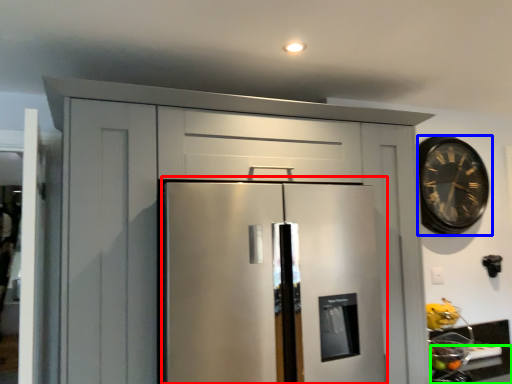
Question: Estimate the real-world distances between objects in this image. Which object is closer to appliance (highlighted by a red box), clock (highlighted by a blue box) or counter top (highlighted by a green box)?

Choices:
 (A) clock
 (B) counter top

Answer: (B)